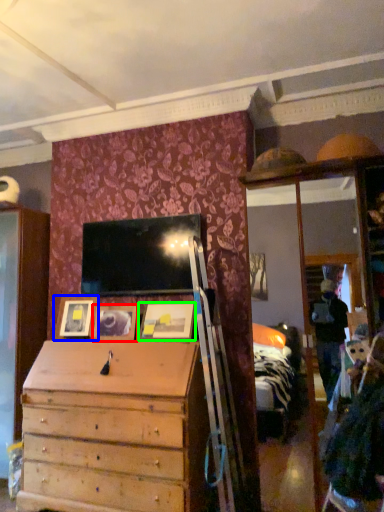
Question: Considering the real-world distances, which object is closest to picture frame (highlighted by a red box)? picture frame (highlighted by a blue box) or picture frame (highlighted by a green box).

Choices:
 (A) picture frame
 (B) picture frame

Answer: (A)